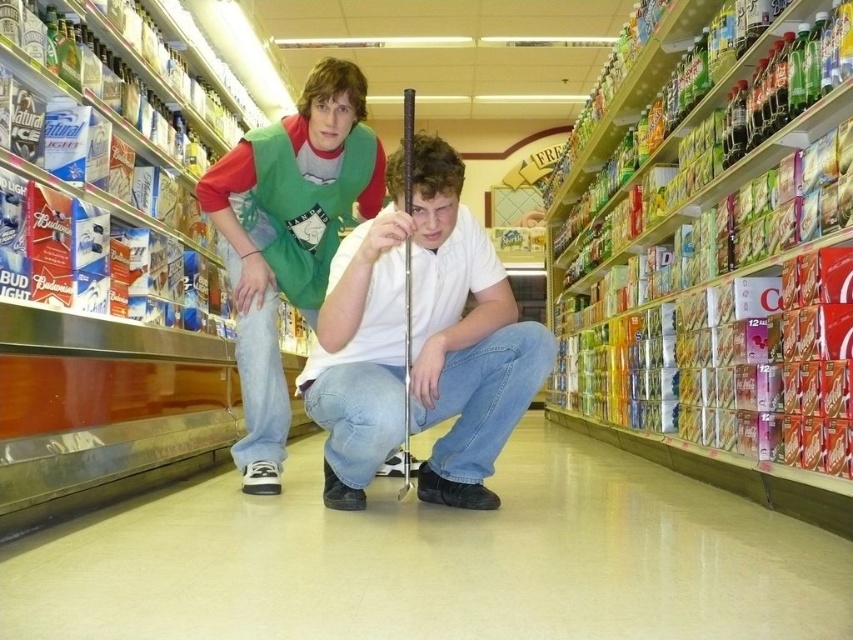
Based on the photo, who is taller, white matte shirt at center or green fabric vest at center?

green fabric vest at center is taller.

Does white matte shirt at center appear over green fabric vest at center?

No.

Is point (476, 465) positioned before point (289, 134)?

Yes.

Find the location of a particular element. This screenshot has height=640, width=853. white matte shirt at center is located at coordinates (421, 342).